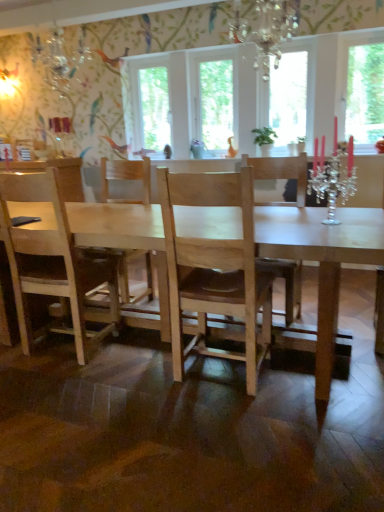
Question: Is the depth of transparent glass window at upper right, arranged as the 4th window screen when viewed from the left, less than that of clear glass window at center, acting as the 1th window screen starting from the left?

Choices:
 (A) no
 (B) yes

Answer: (B)

Question: Is clear glass window at center, acting as the 1th window screen starting from the left, surrounded by transparent glass window at upper right, positioned as the first window screen in right-to-left order?

Choices:
 (A) yes
 (B) no

Answer: (B)

Question: Is transparent glass window at upper right, arranged as the 4th window screen when viewed from the left, positioned with its back to clear glass window at center, which ranks as the 4th window screen in right-to-left order?

Choices:
 (A) no
 (B) yes

Answer: (A)

Question: Considering the relative positions of transparent glass window at upper right, arranged as the 4th window screen when viewed from the left, and clear glass window at center, which ranks as the 4th window screen in right-to-left order, in the image provided, is transparent glass window at upper right, arranged as the 4th window screen when viewed from the left, to the left of clear glass window at center, which ranks as the 4th window screen in right-to-left order, from the viewer's perspective?

Choices:
 (A) yes
 (B) no

Answer: (B)

Question: Is transparent glass window at upper right, arranged as the 4th window screen when viewed from the left, with clear glass window at center, which ranks as the 4th window screen in right-to-left order?

Choices:
 (A) yes
 (B) no

Answer: (B)

Question: From the image's perspective, is crystal chandelier at upper center located above or below transparent glass window at center, the third window screen in the right-to-left sequence?

Choices:
 (A) below
 (B) above

Answer: (A)

Question: Looking at the image, does crystal chandelier at upper center seem bigger or smaller compared to transparent glass window at center, the third window screen in the right-to-left sequence?

Choices:
 (A) big
 (B) small

Answer: (B)

Question: Relative to transparent glass window at center, the third window screen in the right-to-left sequence, is crystal chandelier at upper center in front or behind?

Choices:
 (A) front
 (B) behind

Answer: (A)

Question: Is point (288, 9) closer or farther from the camera than point (223, 110)?

Choices:
 (A) closer
 (B) farther

Answer: (A)

Question: From the image's perspective, is light wood chair at center positioned above or below transparent glass window at upper right, arranged as the 4th window screen when viewed from the left?

Choices:
 (A) below
 (B) above

Answer: (A)

Question: Is light wood chair at center in front of or behind transparent glass window at upper right, positioned as the first window screen in right-to-left order, in the image?

Choices:
 (A) behind
 (B) front

Answer: (B)

Question: From a real-world perspective, relative to transparent glass window at upper right, arranged as the 4th window screen when viewed from the left, is light wood chair at center vertically above or below?

Choices:
 (A) below
 (B) above

Answer: (A)

Question: Considering the positions of light wood chair at center and transparent glass window at upper right, arranged as the 4th window screen when viewed from the left, in the image, is light wood chair at center bigger or smaller than transparent glass window at upper right, arranged as the 4th window screen when viewed from the left,?

Choices:
 (A) small
 (B) big

Answer: (B)

Question: From their relative heights in the image, would you say crystal chandelier at upper center is taller or shorter than green matte plant at upper center?

Choices:
 (A) tall
 (B) short

Answer: (A)

Question: Relative to green matte plant at upper center, is crystal chandelier at upper center in front or behind?

Choices:
 (A) behind
 (B) front

Answer: (B)